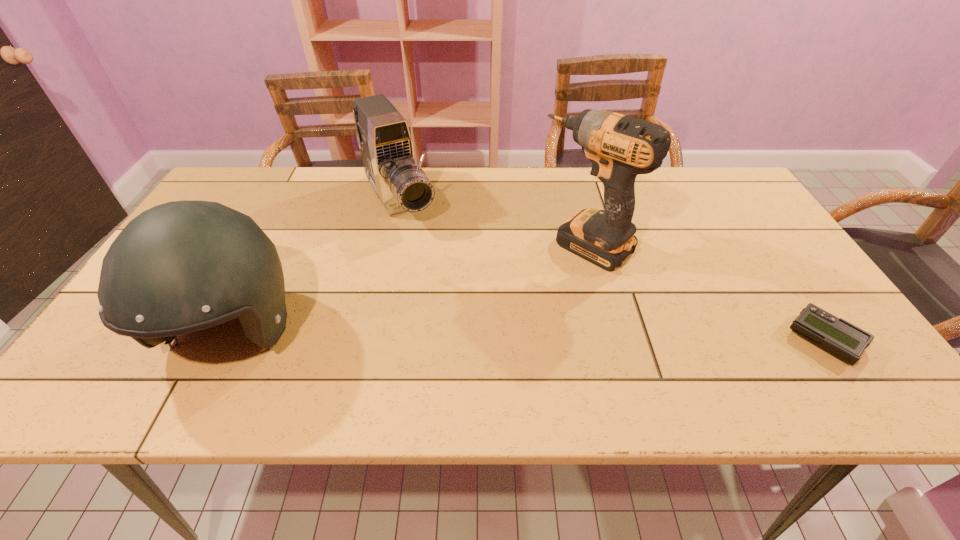
Where is `vacant space at the far edge of the desktop`? The image size is (960, 540). vacant space at the far edge of the desktop is located at coordinates (272, 202).

The height and width of the screenshot is (540, 960). Find the location of `vacant space at the near edge of the desktop`. vacant space at the near edge of the desktop is located at coordinates (444, 355).

At what (x,y) coordinates should I click in order to perform the action: click on free space at the right edge of the desktop. Please return your answer as a coordinate pair (x, y). Image resolution: width=960 pixels, height=540 pixels. Looking at the image, I should click on (721, 240).

The image size is (960, 540). What are the coordinates of `blank area at the near left corner` in the screenshot? It's located at (101, 355).

Where is `vacant region at the far right corner of the desktop`? Image resolution: width=960 pixels, height=540 pixels. vacant region at the far right corner of the desktop is located at coordinates (728, 177).

The width and height of the screenshot is (960, 540). I want to click on empty location between the camcorder and the football helmet, so click(316, 267).

Locate an element on the screen. The height and width of the screenshot is (540, 960). unoccupied position between the third object from left to right and the leftmost object is located at coordinates (409, 289).

Identify the location of free space between the second shortest object and the shortest object. The image size is (960, 540). (612, 271).

At what (x,y) coordinates should I click in order to perform the action: click on vacant space in between the rightmost object and the third object from left to right. Please return your answer as a coordinate pair (x, y). The image size is (960, 540). Looking at the image, I should click on (706, 292).

Locate an element on the screen. The height and width of the screenshot is (540, 960). free space between the shortest object and the camcorder is located at coordinates (612, 271).